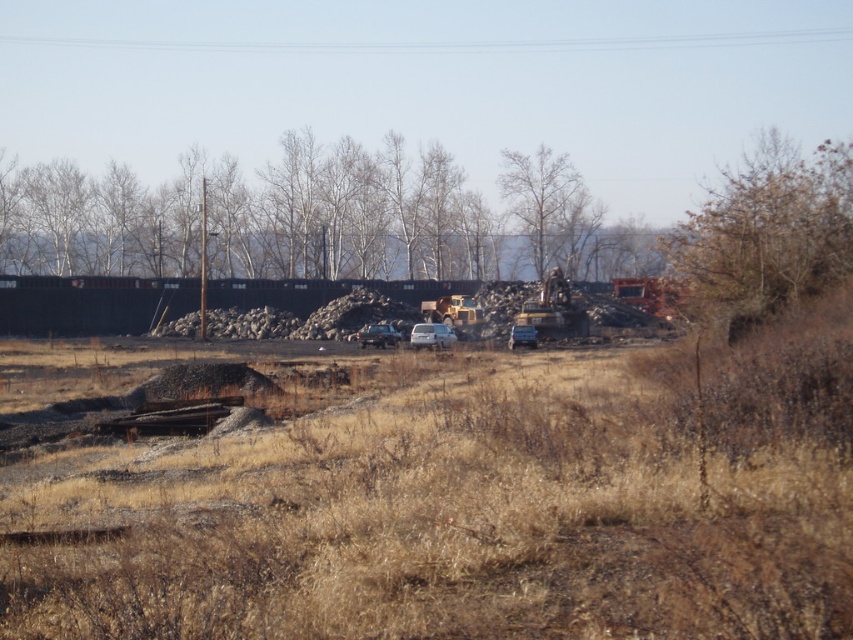
Question: In this image, where is brown dry grass at center located relative to brown leafy tree at upper right?

Choices:
 (A) above
 (B) below

Answer: (B)

Question: Is metallic yellow excavator at center wider than white matte car at center?

Choices:
 (A) yes
 (B) no

Answer: (A)

Question: Does brown dry grass at center have a larger size compared to brown leafy tree at upper right?

Choices:
 (A) no
 (B) yes

Answer: (A)

Question: Among these points, which one is nearest to the camera?

Choices:
 (A) (838, 272)
 (B) (521, 164)
 (C) (553, 284)

Answer: (A)

Question: Among these objects, which one is nearest to the camera?

Choices:
 (A) metallic yellow excavator at center
 (B) brown dry grass at center
 (C) bare wood tree at upper center
 (D) brown leafy tree at upper right

Answer: (B)

Question: Which is farther from the metallic yellow excavator at center?

Choices:
 (A) bare branches at center
 (B) brown leafy tree at upper right

Answer: (A)